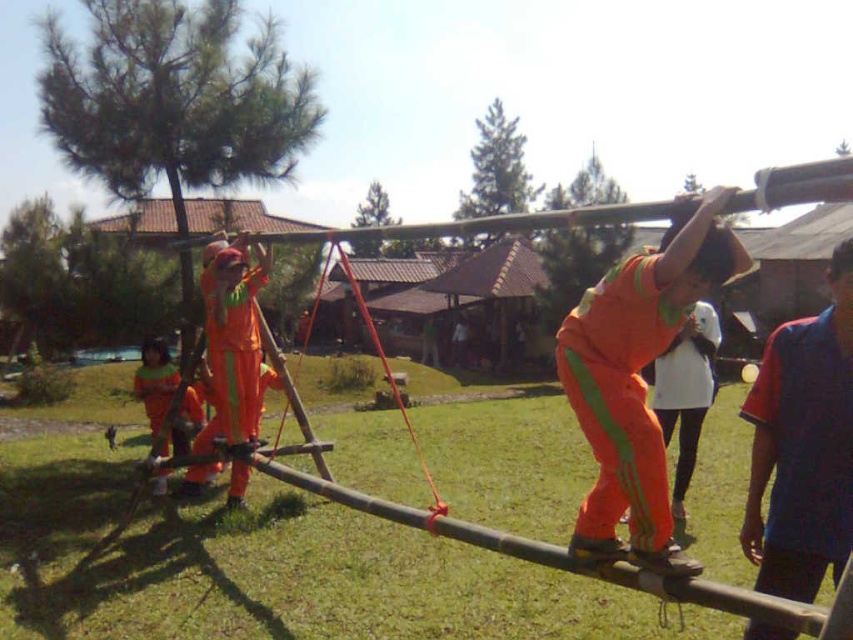
You are standing at the camera position and want to reach the point marked at coordinates (x=612, y=422). If you walk straight ahead, will you reach that point before walking 3 meters?

The point marked at coordinates (x=612, y=422) is 2.70 meters from the camera. Since 2.70 meters is less than 3 meters, walking straight ahead will reach the point before walking 3 meters.

You are standing at the starting point of the balance beam and see two points marked on the beam. The first point is at coordinate point (606, 380) and the second is at point (817, 497). Which point is closer to you as you begin your walk?

Point (606, 380) is closer to you because it is further to the viewer than point (817, 497), meaning it is physically nearer to your starting position.